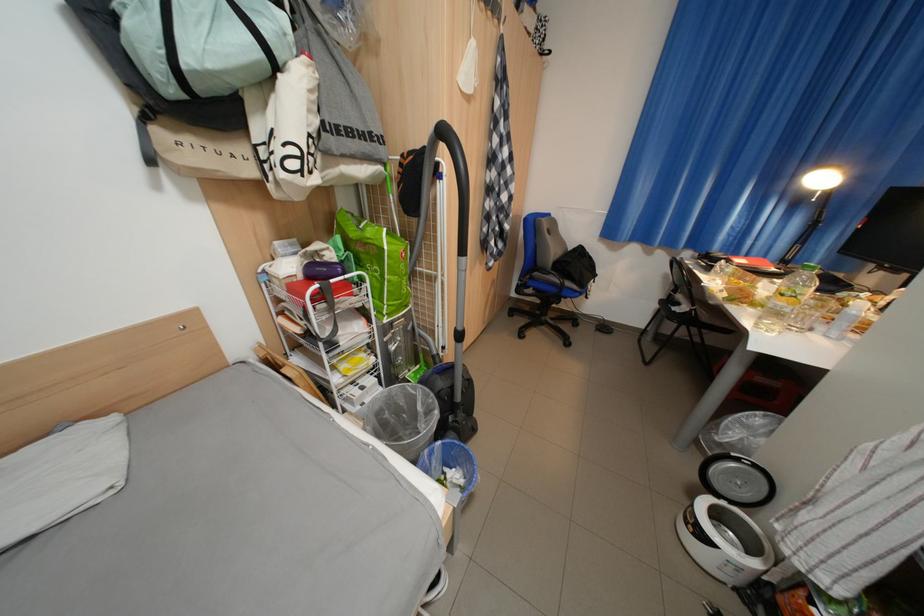
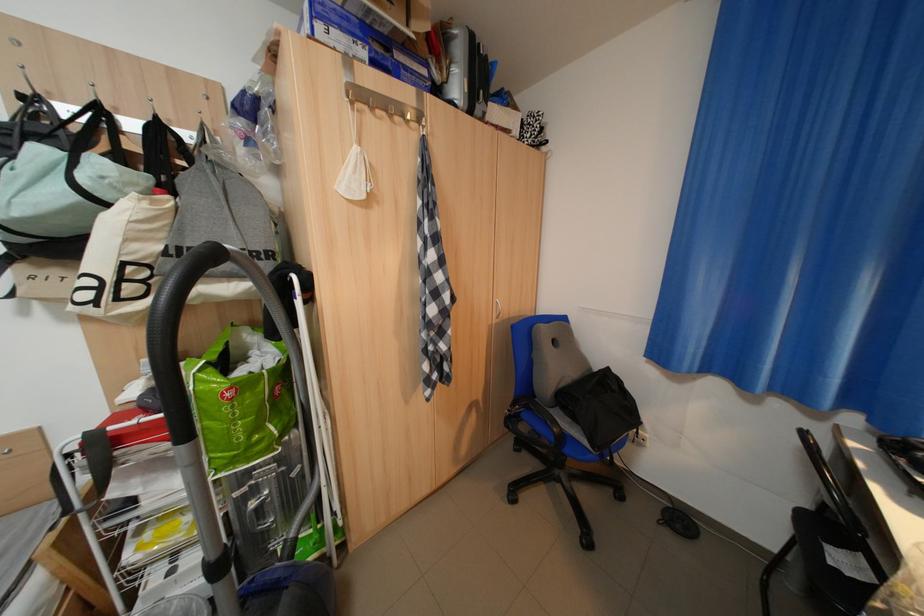
Question: The images are taken continuously from a first-person perspective. In which direction is your viewpoint rotating?

Choices:
 (A) Left
 (B) Right
 (C) Up
 (D) Down

Answer: (A)